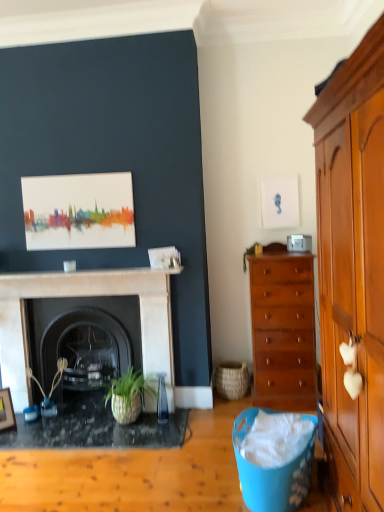
Question: Is granite black desk at center spatially inside woven natural basket at lower center, or outside of it?

Choices:
 (A) inside
 (B) outside

Answer: (B)

Question: Is granite black desk at center in front of or behind woven natural basket at lower center in the image?

Choices:
 (A) behind
 (B) front

Answer: (B)

Question: Estimate the real-world distances between objects in this image. Which object is closer to the green woven plant at left, which appears as the 2th plant when viewed from the top?

Choices:
 (A) granite black desk at center
 (B) black marble fireplace at center, arranged as the 2th fireplace when viewed from the front
 (C) wooden wardrobe at right
 (D) woven natural basket at lower center
 (E) blue plastic trash can at lower center

Answer: (B)

Question: Which object is the closest to the green leafy plant at center-right, the first plant from the right?

Choices:
 (A) black marble fireplace at center, which is the 1th fireplace in front-to-back order
 (B) mahogany wooden chest of drawers at right
 (C) green woven plant at left, positioned as the 1th plant in left-to-right order
 (D) black marble fireplace at center, arranged as the 2th fireplace when viewed from the front
 (E) wooden picture frame at lower left

Answer: (B)